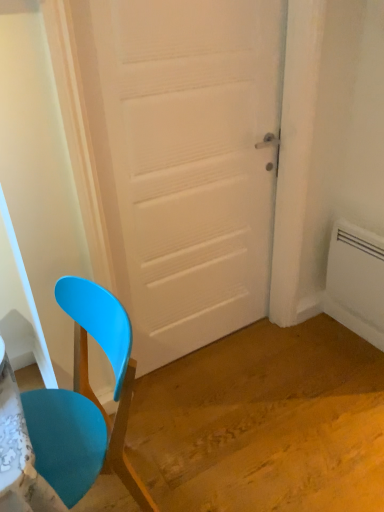
The height and width of the screenshot is (512, 384). I want to click on vacant space that is in between white matte door at center and matte plastic chair at left, so click(197, 415).